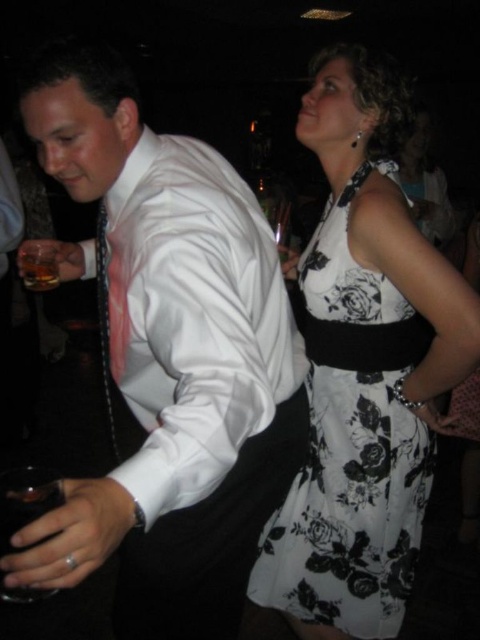
Question: Does white satin shirt at left have a larger size compared to translucent glass at lower left?

Choices:
 (A) no
 (B) yes

Answer: (B)

Question: Can you confirm if white satin shirt at left is positioned below translucent glass at lower left?

Choices:
 (A) yes
 (B) no

Answer: (A)

Question: Which of the following is the farthest from the observer?

Choices:
 (A) (204, 566)
 (B) (434, 196)
 (C) (32, 260)

Answer: (B)

Question: Among these objects, which one is nearest to the camera?

Choices:
 (A) transparent glass at lower left
 (B) translucent glass at lower left
 (C) black floral dress at upper right
 (D) white floral dress at upper right

Answer: (A)

Question: Does white floral dress at upper right have a lesser width compared to transparent glass at lower left?

Choices:
 (A) yes
 (B) no

Answer: (A)

Question: Which point appears closest to the camera in this image?

Choices:
 (A) (48, 282)
 (B) (2, 548)
 (C) (419, 227)

Answer: (A)